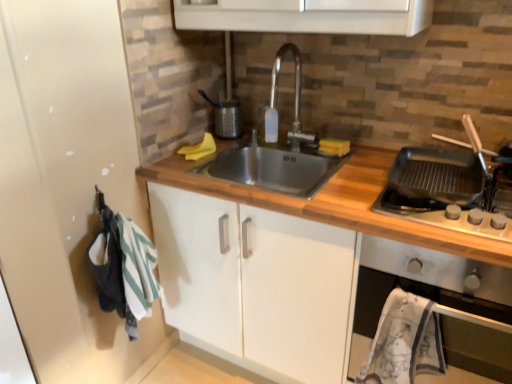
Describe the element at coordinates (268, 263) in the screenshot. I see `wooden at center` at that location.

What is the approximate width of satin nickel faucet at center?

It is 11.65 inches.

Where is `satin nickel faucet at center`? Image resolution: width=512 pixels, height=384 pixels. satin nickel faucet at center is located at coordinates (295, 103).

The height and width of the screenshot is (384, 512). What do you see at coordinates (274, 167) in the screenshot?
I see `stainless steel sink at center` at bounding box center [274, 167].

I want to click on black matte griddle at right, so click(438, 214).

At what (x,y) coordinates should I click in order to perform the action: click on wooden at center. Please return your answer as a coordinate pair (x, y). The height and width of the screenshot is (384, 512). Looking at the image, I should click on (268, 263).

Does point (431, 208) come closer to viewer compared to point (298, 132)?

Yes, point (431, 208) is closer to viewer.

Considering the positions of objects black matte griddle at right and satin nickel faucet at center in the image provided, who is more to the left, black matte griddle at right or satin nickel faucet at center?

satin nickel faucet at center is more to the left.

How many degrees apart are the facing directions of black matte griddle at right and satin nickel faucet at center?

They differ by 1.9 degrees in their facing directions.

Based on the photo, does black matte griddle at right have a greater height compared to satin nickel faucet at center?

No.

Locate an element on the screen. This screenshot has height=384, width=512. tap that appears behind the metallic silver oven at right is located at coordinates (295, 103).

In the scene shown: Can you confirm if satin nickel faucet at center is taller than metallic silver oven at right?

In fact, satin nickel faucet at center may be shorter than metallic silver oven at right.

Is point (267, 120) closer to viewer compared to point (383, 243)?

No, (267, 120) is further to viewer.

Is satin nickel faucet at center touching metallic silver oven at right?

No, satin nickel faucet at center is not beside metallic silver oven at right.

Which is in front, point (297, 79) or point (467, 205)?

Point (467, 205)

Considering the sizes of objects satin nickel faucet at center and black matte griddle at right in the image provided, who is bigger, satin nickel faucet at center or black matte griddle at right?

black matte griddle at right.

Which object is positioned more to the left, satin nickel faucet at center or black matte griddle at right?

satin nickel faucet at center is more to the left.

Is wooden at center further to the viewer compared to metallic silver oven at right?

No, wooden at center is closer to the viewer.

Is point (219, 214) positioned after point (432, 275)?

Yes.

How different are the orientations of wooden at center and metallic silver oven at right in degrees?

2.05 degrees.

Does metallic silver oven at right turn towards wooden at center?

Yes, metallic silver oven at right is turned towards wooden at center.

Is metallic silver oven at right further to camera compared to wooden at center?

Yes, the depth of metallic silver oven at right is greater than that of wooden at center.

From the image's perspective, is metallic silver oven at right beneath wooden at center?

No, from the image's perspective, metallic silver oven at right is not below wooden at center.

Does satin nickel faucet at center have a larger size compared to stainless steel sink at center?

No.

Is satin nickel faucet at center positioned in front of stainless steel sink at center?

That is False.

Based on their positions, is satin nickel faucet at center located to the left or right of stainless steel sink at center?

Based on their positions, satin nickel faucet at center is located to the right of stainless steel sink at center.

From a real-world perspective, relative to stainless steel sink at center, is satin nickel faucet at center vertically above or below?

satin nickel faucet at center is above stainless steel sink at center.

Which is nearer, (257,155) or (313,321)?

Clearly, point (257,155) is more distant from the camera than point (313,321).

Where is `sink above the wooden at center (from a real-world perspective)`? This screenshot has height=384, width=512. sink above the wooden at center (from a real-world perspective) is located at coordinates (274, 167).

Is the position of stainless steel sink at center less distant than that of wooden at center?

That is False.

In the scene shown: Considering the sizes of stainless steel sink at center and wooden at center in the image, is stainless steel sink at center wider or thinner than wooden at center?

Considering their sizes, stainless steel sink at center looks slimmer than wooden at center.

This screenshot has width=512, height=384. Identify the location of tap above the black matte griddle at right (from a real-world perspective). (295, 103).

The width and height of the screenshot is (512, 384). I want to click on oven in front of the satin nickel faucet at center, so click(426, 282).

From the image, which object appears to be nearer to satin nickel faucet at center, black matte griddle at right or stainless steel sink at center?

Among the two, stainless steel sink at center is located nearer to satin nickel faucet at center.

From the image, which object appears to be farther from black matte griddle at right, satin nickel faucet at center or metallic silver oven at right?

satin nickel faucet at center is further to black matte griddle at right.

Which object lies further to the anchor point metallic silver oven at right, black matte griddle at right or wooden at center?

The object further to metallic silver oven at right is wooden at center.

Considering their positions, is wooden at center positioned further to stainless steel sink at center than black matte griddle at right?

The object further to stainless steel sink at center is black matte griddle at right.

Based on their spatial positions, is wooden at center or stainless steel sink at center further from black matte griddle at right?

stainless steel sink at center.

Which object lies nearer to the anchor point metallic silver oven at right, stainless steel sink at center or black matte griddle at right?

black matte griddle at right lies closer to metallic silver oven at right than the other object.

When comparing their distances from black matte griddle at right, does wooden at center or satin nickel faucet at center seem closer?

wooden at center is closer to black matte griddle at right.

When comparing their distances from stainless steel sink at center, does metallic silver oven at right or satin nickel faucet at center seem closer?

satin nickel faucet at center lies closer to stainless steel sink at center than the other object.

Locate an element on the screen. countertop situated between stainless steel sink at center and black matte griddle at right from left to right is located at coordinates (268, 263).

The height and width of the screenshot is (384, 512). Find the location of `sink between satin nickel faucet at center and wooden at center from top to bottom`. sink between satin nickel faucet at center and wooden at center from top to bottom is located at coordinates (274, 167).

Identify the location of gas stove that lies between satin nickel faucet at center and wooden at center from top to bottom. This screenshot has width=512, height=384. (438, 214).

Where is `gas stove located between stainless steel sink at center and metallic silver oven at right in the left-right direction`? The image size is (512, 384). gas stove located between stainless steel sink at center and metallic silver oven at right in the left-right direction is located at coordinates (438, 214).